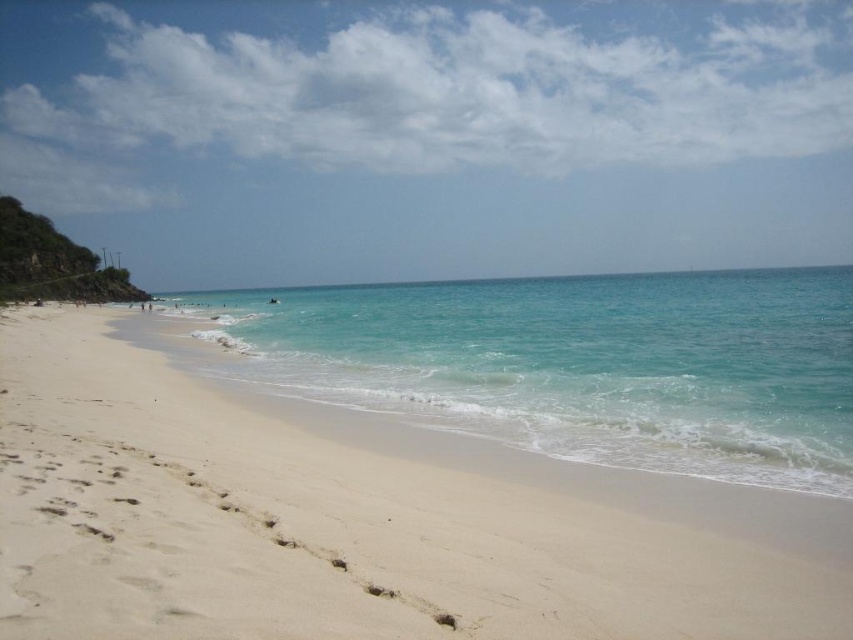
Question: Is white sandy beach at lower left bigger than clear blue water at center?

Choices:
 (A) yes
 (B) no

Answer: (B)

Question: Which point is farther from the camera taking this photo?

Choices:
 (A) (822, 337)
 (B) (637, 540)

Answer: (A)

Question: Can you confirm if white sandy beach at lower left is thinner than clear blue water at center?

Choices:
 (A) yes
 (B) no

Answer: (A)

Question: Is white sandy beach at lower left bigger than clear blue water at center?

Choices:
 (A) yes
 (B) no

Answer: (B)